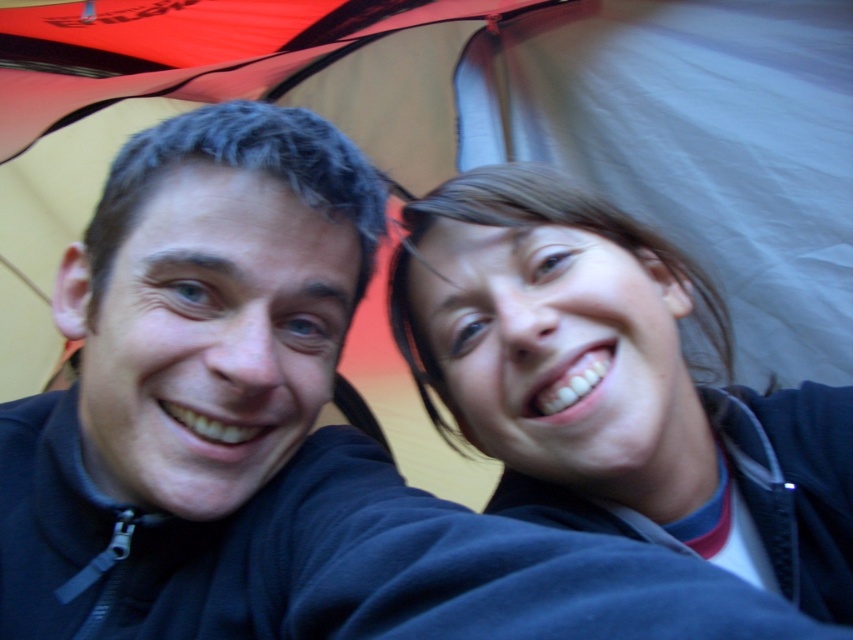
You are a photographer trying to capture a closeup of the smooth skin face at upper right without including the black matte jacket at left in the frame. Based on their relative sizes in the image, is this possible?

The black matte jacket at left is taller than the smooth skin face at upper right, so it might block the view. To capture the smooth skin face at upper right without the jacket, you need to adjust the camera angle or move closer to ensure the jacket doesn

You are holding a camera and want to take a photo of the scene. The camera is currently at point with coordinates point (155, 224). To ensure the entire scene is captured, you need to adjust the camera position so that it is at least 30 inches away from the point. Is the camera currently positioned far enough?

The point (155, 224) and camera are 27.38 inches apart from each other, which is less than the required 30 inches. Therefore, the camera is not positioned far enough to capture the entire scene.

You are a photographer trying to edit this image. You need to adjust the focus on the black matte jacket at left and the smooth skin face at upper right. Which object is positioned to the left of the other?

The black matte jacket at left is to the left of the smooth skin face at upper right.